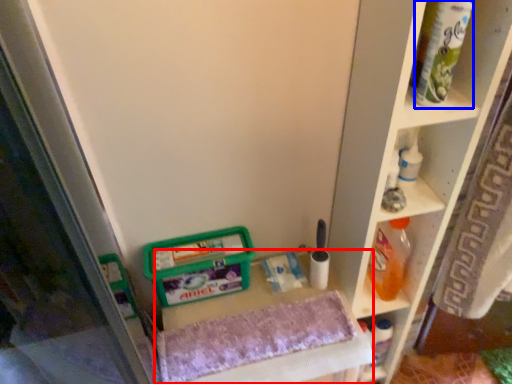
Question: Which object is closer to the camera taking this photo, vanity (highlighted by a red box) or tube (highlighted by a blue box)?

Choices:
 (A) vanity
 (B) tube

Answer: (B)